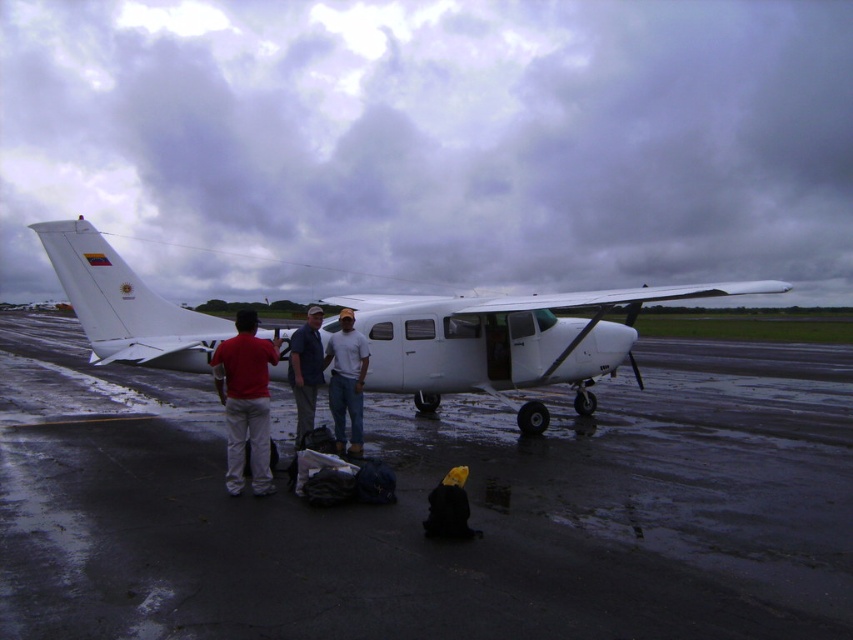
You are a photographer positioned at the back of the aircraft. You want to take a photo of the matte red shirt at center and the white matte shirt at center without any obstructions. Based on their positions, which shirt should be placed in the foreground to ensure the other remains visible in the background?

The matte red shirt at center is located below the white matte shirt at center. Since the photographer is at the back of the aircraft, the red shirt being lower means it would be in the foreground, blocking the white shirt. To avoid obstruction, the white matte shirt at center should be in the foreground and the matte red shirt at center in the background. Wait, this seems contradictory. Let me think again. If the red shirt is below the white one, then from the photographer position, lower position might be

You are standing on the tarmac and want to reach the point marked at coordinates (329, 397). The aircraft is between you and that point. Can you walk around the aircraft to reach it without going through the aircraft itself?

The distance of point (329, 397) from viewer is 7.34 meters. Since the aircraft is between you and the point, you can walk around the aircraft to reach it as long as there is enough space around the aircraft to navigate without going through it.

You are standing at the point marked by the coordinates point (245, 401). You want to walk directly towards the person in the matte red shirt at center. Which direction should you go?

The matte red shirt at center is located at point (245, 401), so you are already at the same location as the person in the matte red shirt at center.